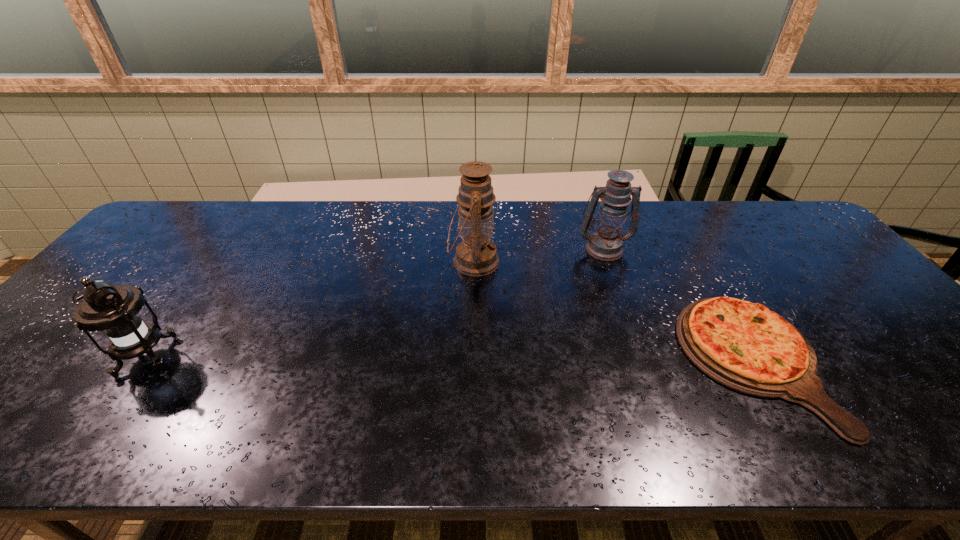
The height and width of the screenshot is (540, 960). I want to click on vacant space situated on the right of the nearer lantern, so point(225,357).

The height and width of the screenshot is (540, 960). I want to click on free space located 0.070m on the left of the shortest object, so click(x=657, y=362).

Identify the location of oil lamp present at the far edge. Image resolution: width=960 pixels, height=540 pixels. (476, 255).

Locate an element on the screen. The width and height of the screenshot is (960, 540). lantern that is at the far edge is located at coordinates (605, 243).

Where is `object at the near edge`? object at the near edge is located at coordinates (744, 346).

I want to click on vacant area at the far edge of the desktop, so click(x=252, y=206).

You are a GUI agent. You are given a task and a screenshot of the screen. Output one action in this format:
    pyautogui.click(x=<x>, y=<y>)
    Task: Click on the vacant space at the near edge of the desktop
    
    Given the screenshot: What is the action you would take?
    pyautogui.click(x=777, y=435)

Identify the location of free space at the left edge of the desktop. (70, 344).

The image size is (960, 540). Find the location of `vacant region at the right edge of the desktop`. vacant region at the right edge of the desktop is located at coordinates (827, 254).

At what (x,y) coordinates should I click in order to perform the action: click on vacant space at the near left corner of the desktop. Please return your answer as a coordinate pair (x, y). This screenshot has height=540, width=960. Looking at the image, I should click on (2, 420).